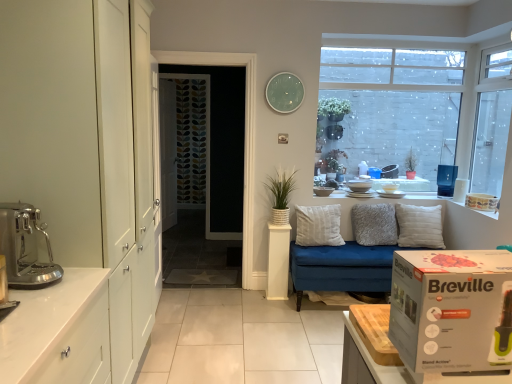
Locate an element on the screen. free space in front of satin silver coffee machine at left is located at coordinates (30, 296).